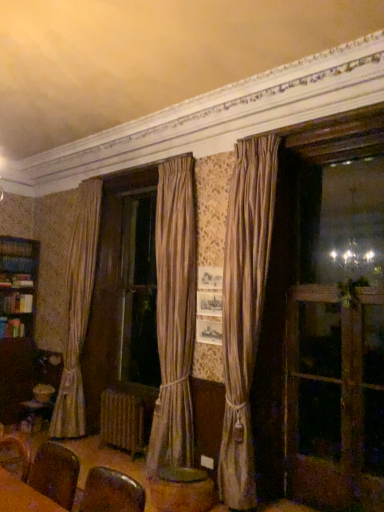
Question: Is silky beige curtain at center wider or thinner than wooden screen door at right?

Choices:
 (A) thin
 (B) wide

Answer: (B)

Question: Is silky beige curtain at center bigger or smaller than wooden screen door at right?

Choices:
 (A) small
 (B) big

Answer: (B)

Question: Which object is positioned closest to the silky beige curtain at center?

Choices:
 (A) wooden screen door at right
 (B) brown leather armchair at lower left
 (C) wooden round table at center
 (D) white textured radiator at lower center

Answer: (A)

Question: Which object is positioned farthest from the silky beige curtain at center?

Choices:
 (A) white textured radiator at lower center
 (B) wooden round table at center
 (C) brown leather armchair at lower left
 (D) wooden screen door at right

Answer: (C)